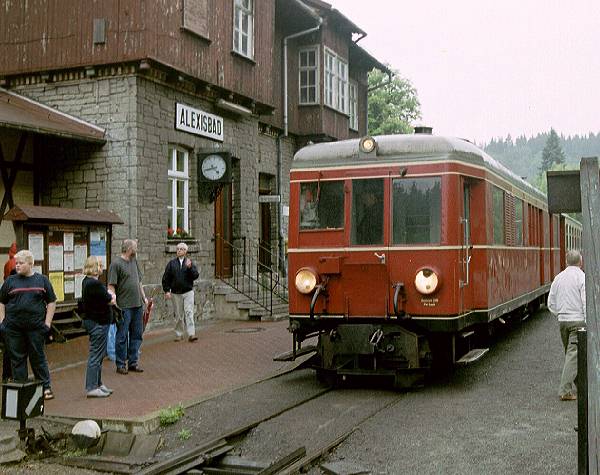
The image size is (600, 475). In order to click on lights in this screenshot , I will do `click(306, 280)`, `click(426, 282)`.